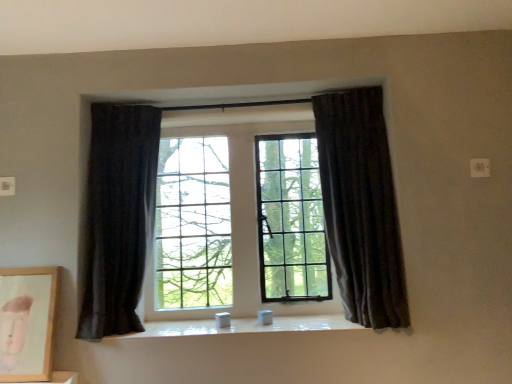
Question: Based on their sizes in the image, would you say white glossy window sill at center is bigger or smaller than dark fabric curtain at left, positioned as the 1th curtain in left-to-right order?

Choices:
 (A) small
 (B) big

Answer: (A)

Question: Looking at their shapes, would you say white glossy window sill at center is wider or thinner than dark fabric curtain at left, positioned as the 1th curtain in left-to-right order?

Choices:
 (A) wide
 (B) thin

Answer: (A)

Question: Which object is positioned farthest from the dark velvet curtain at right, arranged as the 2th curtain when viewed from the left?

Choices:
 (A) matte wooden picture frame at lower left
 (B) dark fabric curtain at left, arranged as the second curtain when viewed from the right
 (C) white glossy window sill at center

Answer: (A)

Question: Which is farther from the white glossy window sill at center?

Choices:
 (A) dark fabric curtain at left, arranged as the second curtain when viewed from the right
 (B) matte wooden picture frame at lower left
 (C) dark velvet curtain at right, which ranks as the 1th curtain in right-to-left order

Answer: (C)